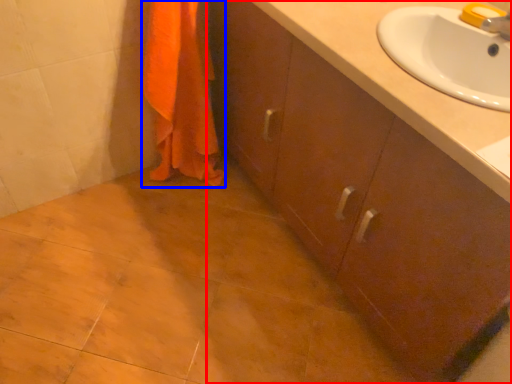
Question: Among these objects, which one is nearest to the camera, bathroom cabinet (highlighted by a red box) or bath towel (highlighted by a blue box)?

Choices:
 (A) bathroom cabinet
 (B) bath towel

Answer: (A)